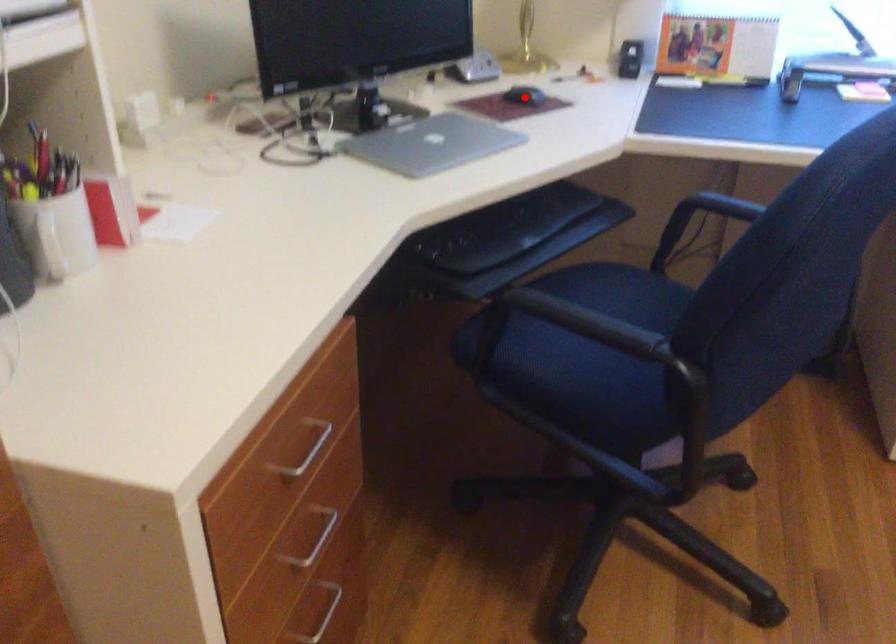
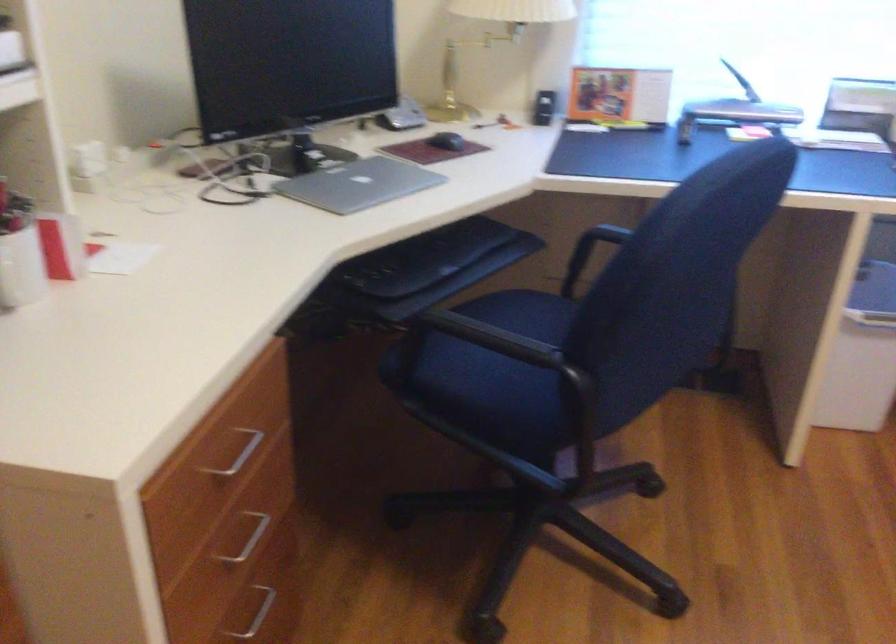
Where in the second image is the point corresponding to the highlighted location from the first image?

(446, 140)